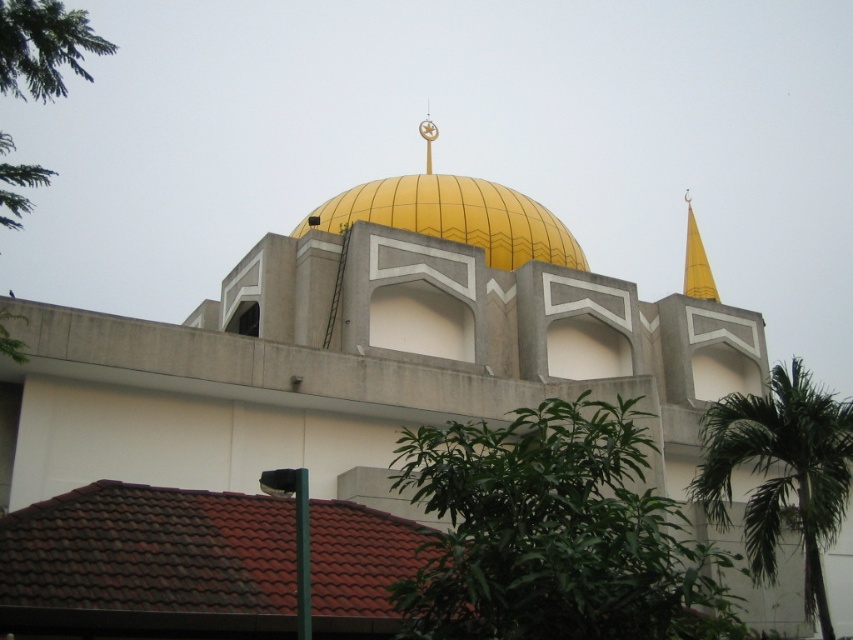
You are standing in front of the mosque and want to take a photo focusing on two specific points on the building. The first point is at coordinates point (538, 560) and the second is at point (693, 237). Which point will appear larger in your photo?

Point (538, 560) is closer to the camera than point (693, 237), so it will appear larger in the photo.

You are standing in front of a mosque with a yellow dome and a smaller golden spire to the right. There is a specific point marked at coordinates point (67, 45). If you want to take a photo that includes both the main dome and this point, will you need to adjust your camera angle to include the point in the frame?

The point (67, 45) is 39.18 meters away from the camera. Since the main dome is part of the mosque structure which is likely within the same general area, the distance suggests the point is within the same field of view. Therefore, you should be able to include both in the frame without major adjustments.

You are an architect assessing the proportions of the building. Which object between the green leafy tree at lower center and the gold metallic spire at upper center has a larger size?

The green leafy tree at lower center is bigger than the gold metallic spire at upper center according to the description.